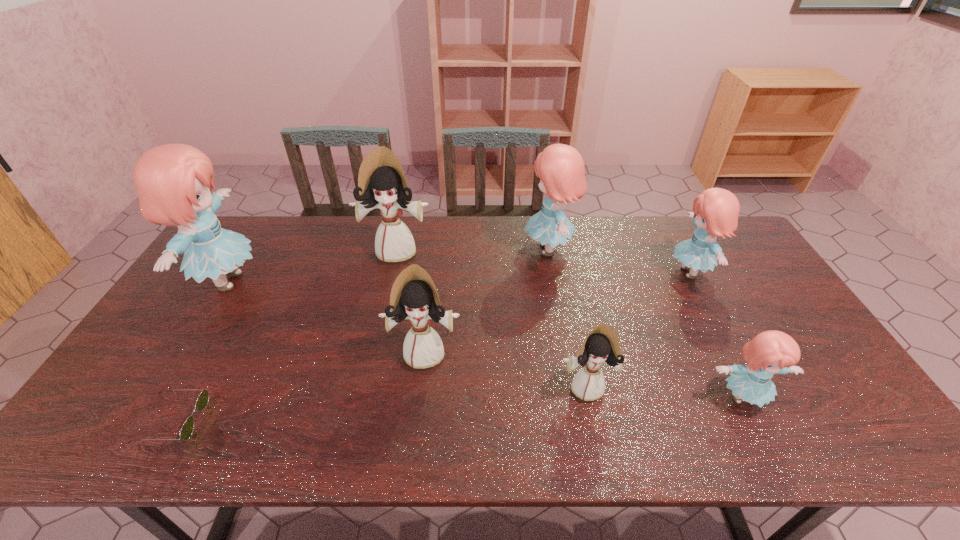
Where is `free point between the third blue doll from right to left and the second biggest black doll`? The image size is (960, 540). free point between the third blue doll from right to left and the second biggest black doll is located at coordinates (487, 301).

The width and height of the screenshot is (960, 540). In order to click on free point between the third blue doll from right to left and the biggest blue doll in this screenshot , I will do `click(388, 265)`.

Find the location of a particular element. The width and height of the screenshot is (960, 540). the fifth closest object to the second blue doll from left to right is located at coordinates (771, 352).

Identify which object is located as the nearest to the second smallest black doll. Please provide its 2D coordinates. Your answer should be formatted as a tuple, i.e. [(x, y)], where the tuple contains the x and y coordinates of a point satisfying the conditions above.

[(602, 345)]

Identify which doll is the second closest to the third biggest blue doll. Please provide its 2D coordinates. Your answer should be formatted as a tuple, i.e. [(x, y)], where the tuple contains the x and y coordinates of a point satisfying the conditions above.

[(771, 352)]

Locate an element on the screen. The width and height of the screenshot is (960, 540). doll that stands as the sixth closest to the third smallest blue doll is located at coordinates (173, 181).

Identify the location of blue doll that is the second closest to the third biggest blue doll. (771, 352).

Select which blue doll appears as the second closest to the second biggest black doll. Please provide its 2D coordinates. Your answer should be formatted as a tuple, i.e. [(x, y)], where the tuple contains the x and y coordinates of a point satisfying the conditions above.

[(173, 181)]

Select which black doll appears as the closest to the second smallest black doll. Please provide its 2D coordinates. Your answer should be formatted as a tuple, i.e. [(x, y)], where the tuple contains the x and y coordinates of a point satisfying the conditions above.

[(602, 345)]

Identify which black doll is located as the nearest to the smallest black doll. Please provide its 2D coordinates. Your answer should be formatted as a tuple, i.e. [(x, y)], where the tuple contains the x and y coordinates of a point satisfying the conditions above.

[(414, 296)]